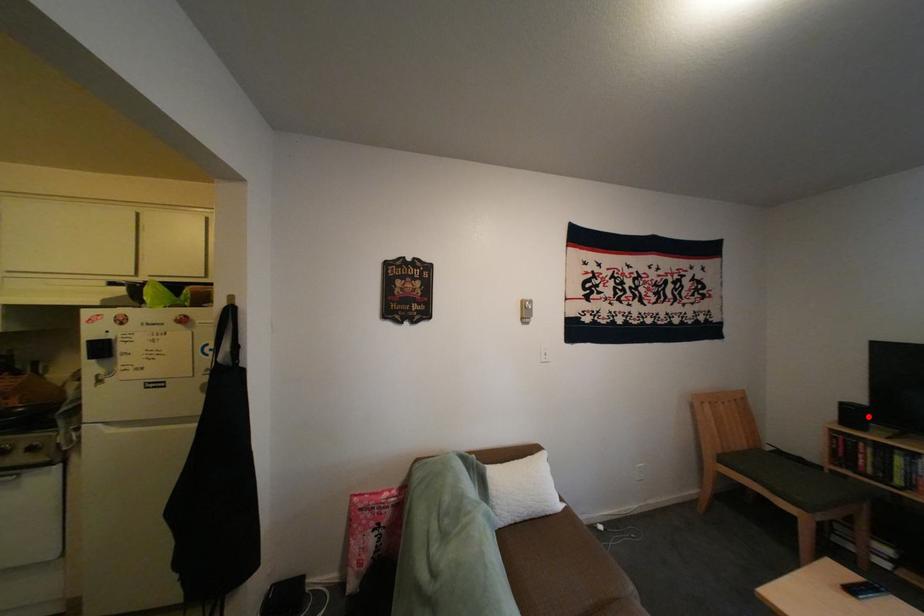
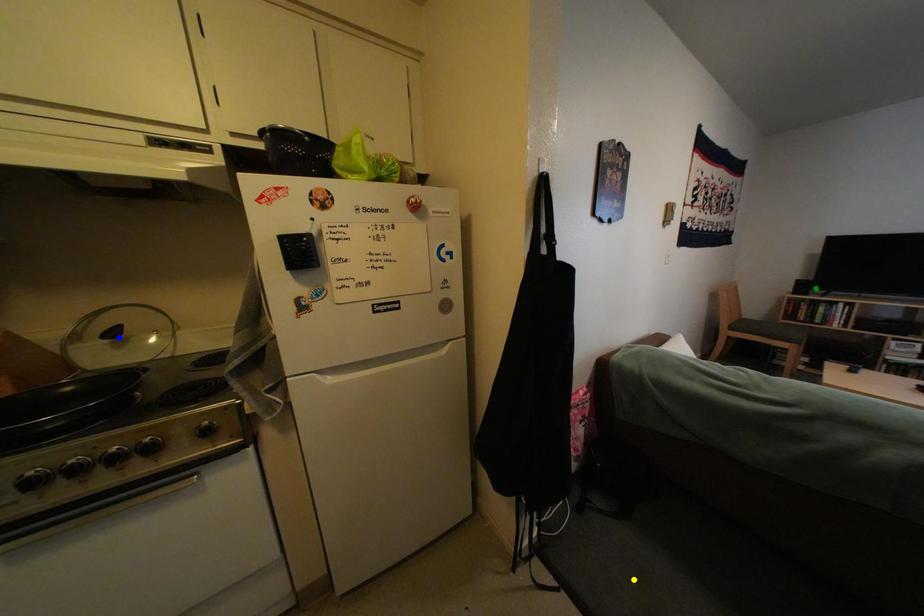
Question: I am providing you with two images of the same scene from different viewpoints. A red point is marked on the first image. You are given multiple points on the second image. Which point in image 2 represents the same 3d spot as the red point in image 1?

Choices:
 (A) yellow point
 (B) green point
 (C) blue point

Answer: (B)